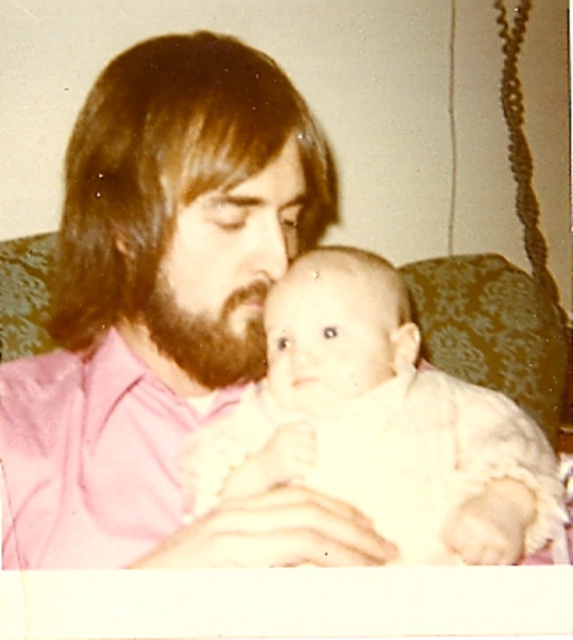
Who is lower down, white fluffy baby at center or dark brown fuzzy beard at center?

white fluffy baby at center is lower down.

Does white fluffy baby at center have a larger size compared to dark brown fuzzy beard at center?

Correct, white fluffy baby at center is larger in size than dark brown fuzzy beard at center.

The height and width of the screenshot is (640, 573). I want to click on white fluffy baby at center, so (x=380, y=422).